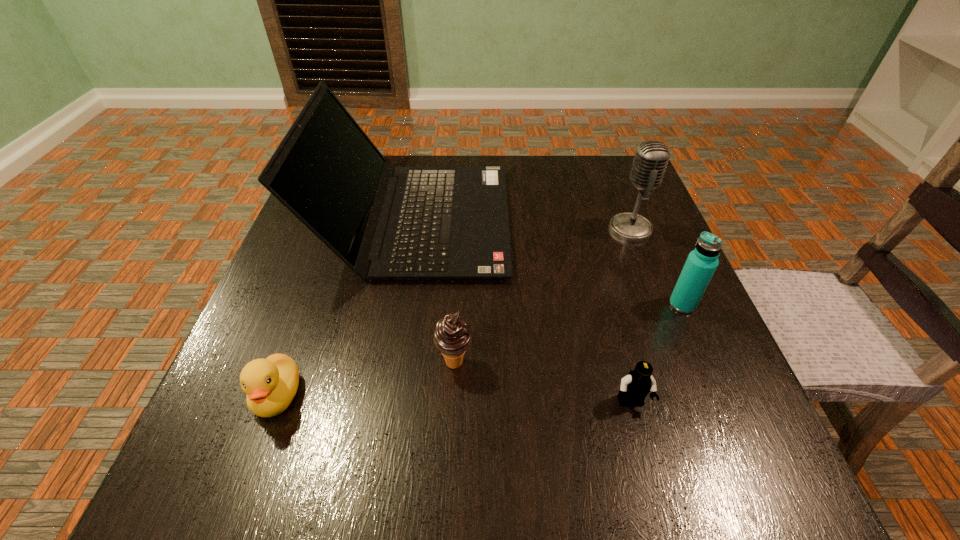
At what (x,y) coordinates should I click in order to perform the action: click on free space located on the left of the icecream. Please return your answer as a coordinate pair (x, y). This screenshot has height=540, width=960. Looking at the image, I should click on (366, 362).

Find the location of a particular element. The image size is (960, 540). vacant region located 0.080m on the face of the duckling is located at coordinates (247, 481).

This screenshot has height=540, width=960. Identify the location of free region located 0.130m on the front-facing side of the Lego. (658, 502).

What are the coordinates of `object located at the far edge` in the screenshot? It's located at (413, 223).

The width and height of the screenshot is (960, 540). Find the location of `laptop computer that is at the left edge`. laptop computer that is at the left edge is located at coordinates (413, 223).

In order to click on duckling located at the left edge in this screenshot , I will do `click(270, 384)`.

What are the coordinates of `microphone that is at the right edge` in the screenshot? It's located at (651, 158).

Identify the location of water bottle that is positioned at the right edge. (702, 262).

What are the coordinates of `Lego that is at the right edge` in the screenshot? It's located at (638, 383).

I want to click on object at the far left corner, so click(x=413, y=223).